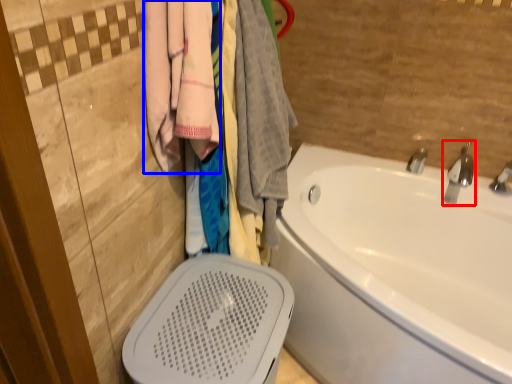
Question: Which object appears closest to the camera in this image, tap (highlighted by a red box) or clothing (highlighted by a blue box)?

Choices:
 (A) tap
 (B) clothing

Answer: (B)